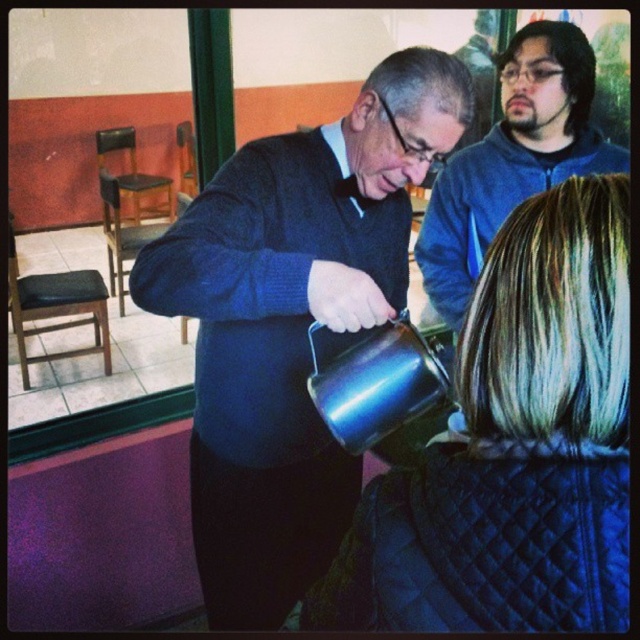
Where is `black quilted jacket at lower right`? Image resolution: width=640 pixels, height=640 pixels. black quilted jacket at lower right is located at coordinates (513, 448).

Measure the distance between black quilted jacket at lower right and camera.

black quilted jacket at lower right and camera are 21.73 inches apart from each other.

Who is more distant from viewer, (509, 586) or (534, 29)?

Positioned behind is point (534, 29).

At what (x,y) coordinates should I click in order to perform the action: click on black quilted jacket at lower right. Please return your answer as a coordinate pair (x, y). Looking at the image, I should click on (513, 448).

Can you confirm if metallic blue kettle at center is bigger than black quilted jacket at lower right?

Correct, metallic blue kettle at center is larger in size than black quilted jacket at lower right.

Which is in front, point (204, 340) or point (464, 531)?

Point (464, 531)

Which is behind, point (314, 426) or point (369, 627)?

Point (314, 426)

Where is `metallic blue kettle at center`? Image resolution: width=640 pixels, height=640 pixels. metallic blue kettle at center is located at coordinates (292, 323).

Does metallic blue kettle at center have a greater height compared to blue fleece jacket at upper right?

Yes, metallic blue kettle at center is taller than blue fleece jacket at upper right.

Between metallic blue kettle at center and blue fleece jacket at upper right, which one appears on the left side from the viewer's perspective?

Positioned to the left is metallic blue kettle at center.

Measure the distance between point (x=214, y=508) and camera.

Point (x=214, y=508) and camera are 1.44 meters apart.

The height and width of the screenshot is (640, 640). I want to click on metallic blue kettle at center, so click(292, 323).